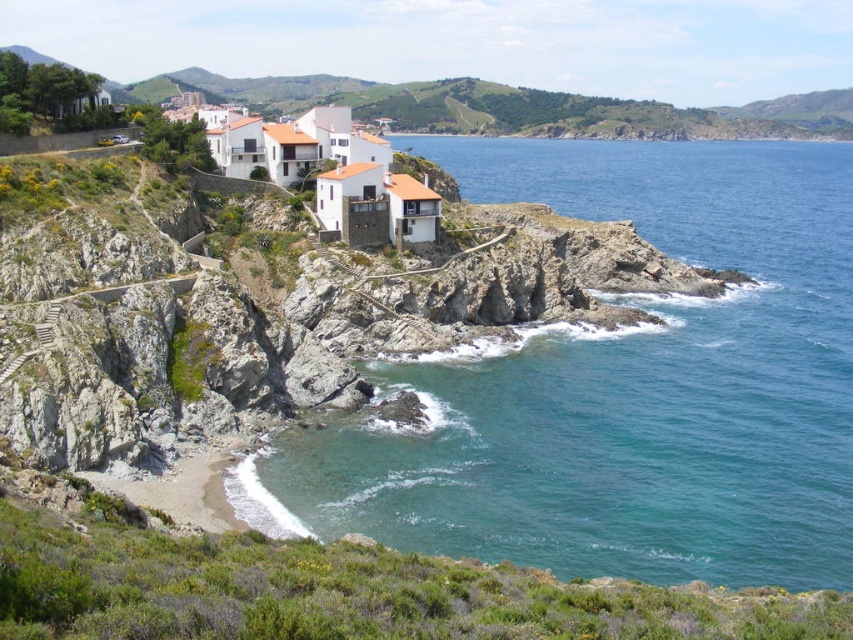
You are a photographer planning to take a wide shot of the coastal scene. The blue water at lower right and the white matte houses at upper center are both in your frame. Based on their sizes in the image, which one would appear larger in your photo?

The blue water at lower right is bigger than the white matte houses at upper center, so it would appear larger in the photo.

You are standing at the top of the cliff near the white matte houses at upper center and want to reach the blue water at lower right. Which direction should you go to get there?

The blue water at lower right is located below the white matte houses at upper center, so you should head downward towards the lower right direction to reach it.